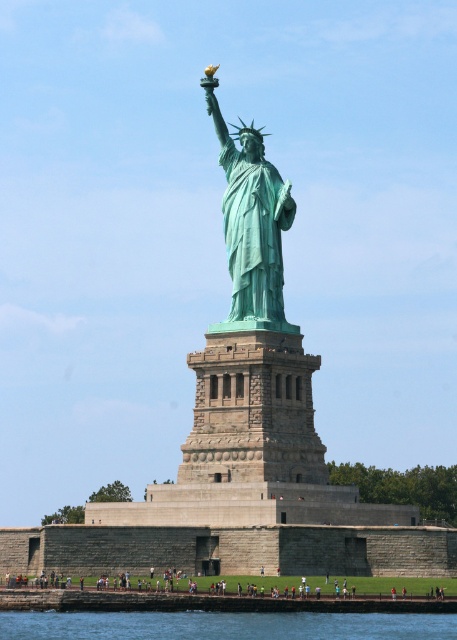
Based on the photo, you are standing at the observation deck of the Statue of Liberty. You want to take a photo of the point at coordinates point [431,627]. The camera you are using has a maximum zoom range of 200 feet. Can you capture the point in your photo without moving closer?

The point [431,627] is 294.27 feet away from the camera. Since the camera can only zoom up to 200 feet, it cannot capture the point without moving closer.

You are a tourist standing on the observation deck of the statue. You see the blue water at lower center and the green patina statue at center. Which object is located lower in the image?

The blue water at lower center is positioned under the green patina statue at center, so it is located lower in the image.